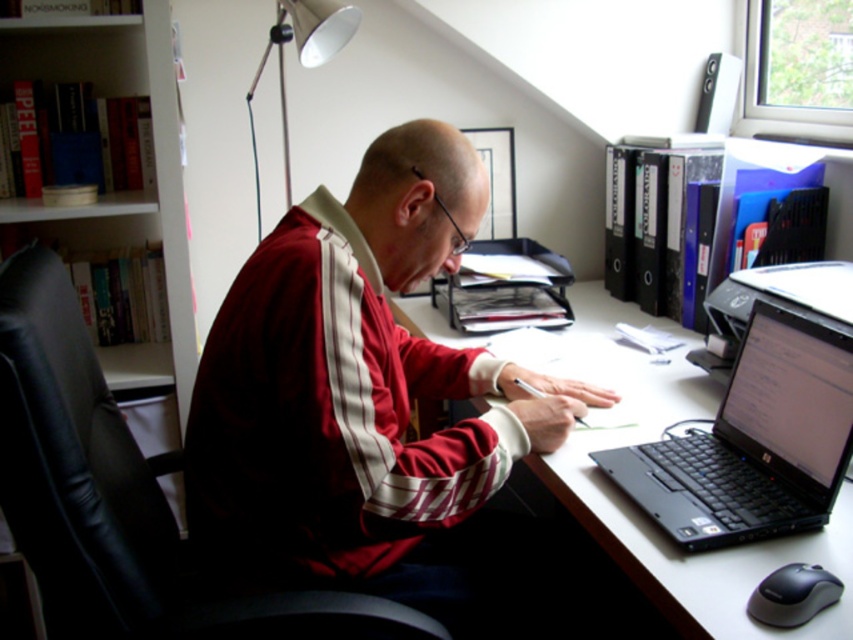
You are a delivery person who needs to place a small package on the desk in the home office scene. The package must be placed at the exact coordinates where the matte red tracksuit at center is located. Can you confirm if this placement is possible given the desk layout?

The matte red tracksuit at center is located at coordinates point (360,396), so yes, the package can be placed there as long as there is space on the desk at that position.

You are standing in the room and want to place a new keyboard between the white glossy computer desk at center and the black plastic mouse at lower right. Since the desk is closer to you, will the keyboard be placed closer to the desk or the mouse?

The white glossy computer desk at center is closer to the viewer than the black plastic mouse at lower right. Therefore, placing the keyboard between them would position it closer to the desk since the desk is nearer to you.